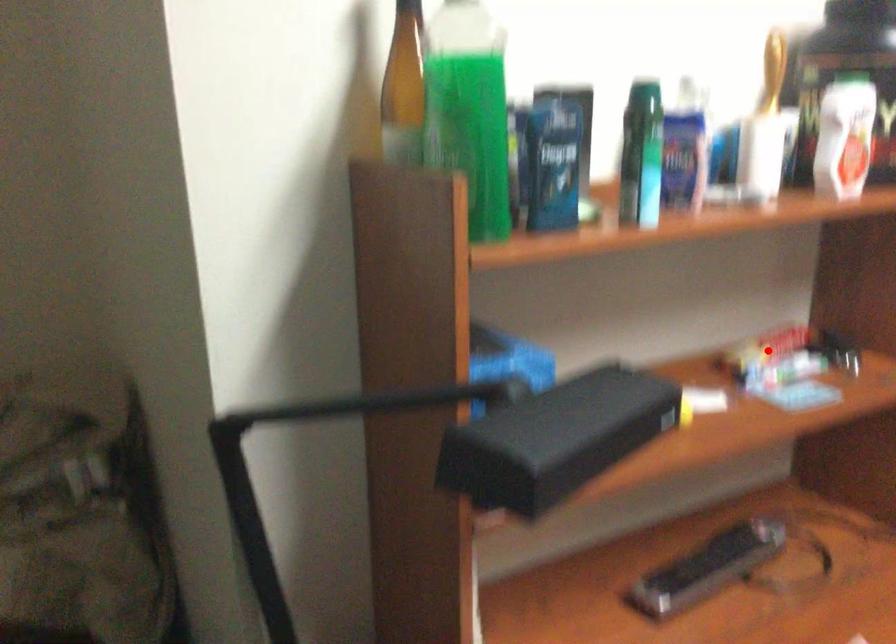
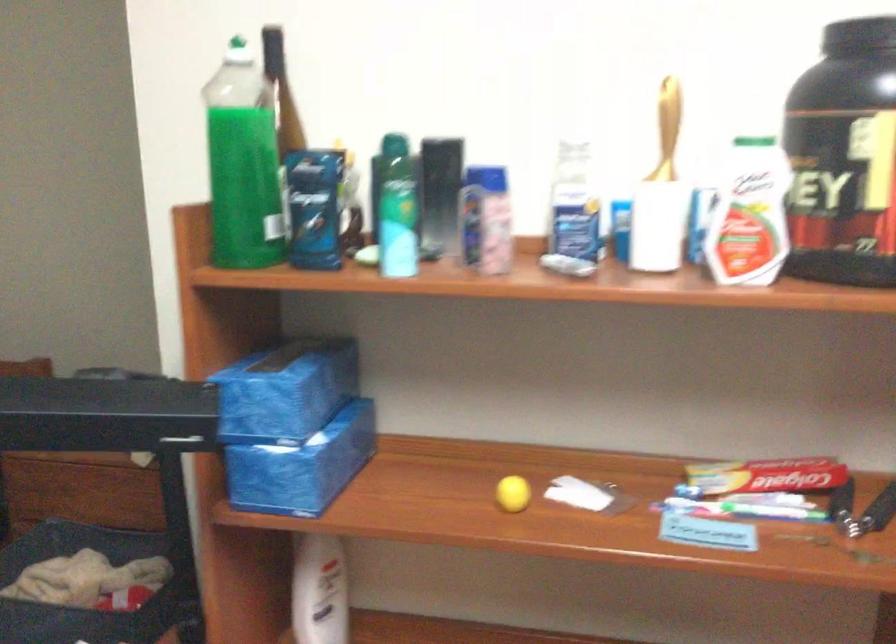
Find the pixel in the second image that matches the highlighted location in the first image.

(764, 483)